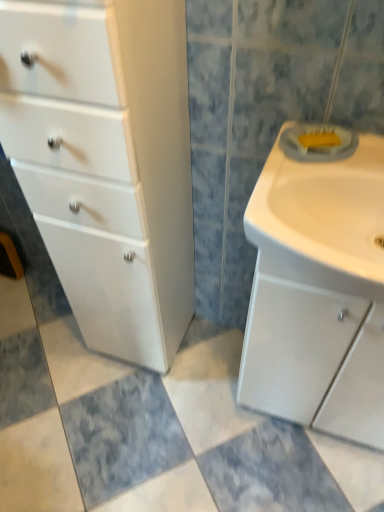
Identify the location of free space between white glossy cabinet at left and white matte sink cabinet at right. (208, 365).